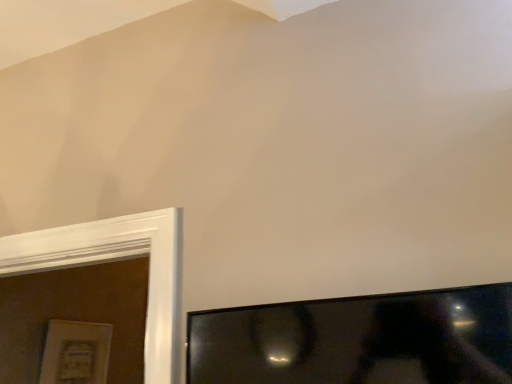
The height and width of the screenshot is (384, 512). Describe the element at coordinates (359, 340) in the screenshot. I see `black glossy tv at lower right` at that location.

Find the location of `black glossy tv at lower right`. black glossy tv at lower right is located at coordinates (359, 340).

What is the approximate height of black glossy tv at lower right?

It is 6.74 inches.

Locate an element on the screen. The height and width of the screenshot is (384, 512). matte white picture frame at lower left is located at coordinates (76, 353).

The image size is (512, 384). Describe the element at coordinates (76, 353) in the screenshot. I see `matte white picture frame at lower left` at that location.

The height and width of the screenshot is (384, 512). I want to click on black glossy tv at lower right, so click(359, 340).

Which object is positioned more to the right, black glossy tv at lower right or matte white picture frame at lower left?

From the viewer's perspective, black glossy tv at lower right appears more on the right side.

Is black glossy tv at lower right behind matte white picture frame at lower left?

No, it is not.

Which point is more distant from viewer, [445,338] or [86,372]?

Positioned behind is point [86,372].

From the image's perspective, is black glossy tv at lower right located beneath matte white picture frame at lower left?

No, from the image's perspective, black glossy tv at lower right is not beneath matte white picture frame at lower left.

From a real-world perspective, relative to matte white picture frame at lower left, is black glossy tv at lower right vertically above or below?

black glossy tv at lower right is situated higher than matte white picture frame at lower left in the real world.

Is black glossy tv at lower right wider than matte white picture frame at lower left?

Yes.

Does black glossy tv at lower right have a greater height compared to matte white picture frame at lower left?

In fact, black glossy tv at lower right may be shorter than matte white picture frame at lower left.

Who is smaller, black glossy tv at lower right or matte white picture frame at lower left?

With smaller size is matte white picture frame at lower left.

Is black glossy tv at lower right situated inside matte white picture frame at lower left or outside?

The correct answer is: outside.

Based on the photo, are black glossy tv at lower right and matte white picture frame at lower left far apart?

Yes.

Consider the image. Is black glossy tv at lower right oriented towards matte white picture frame at lower left?

No, black glossy tv at lower right is not facing towards matte white picture frame at lower left.

What's the angular difference between black glossy tv at lower right and matte white picture frame at lower left's facing directions?

They differ by 90 degrees in their facing directions.

How much distance is there between black glossy tv at lower right and matte white picture frame at lower left?

1.33 meters.

In the image, there is a matte white picture frame at lower left. At what (x,y) coordinates should I click in order to perform the action: click on television above it (from the image's perspective). Please return your answer as a coordinate pair (x, y). This screenshot has height=384, width=512. Looking at the image, I should click on (359, 340).

Is matte white picture frame at lower left at the right side of black glossy tv at lower right?

No.

Considering the positions of objects matte white picture frame at lower left and black glossy tv at lower right in the image provided, who is behind, matte white picture frame at lower left or black glossy tv at lower right?

matte white picture frame at lower left is more distant.

Which is nearer, (102, 355) or (410, 324)?

Clearly, point (102, 355) is more distant from the camera than point (410, 324).

From the image's perspective, would you say matte white picture frame at lower left is positioned over black glossy tv at lower right?

No, from the image's perspective, matte white picture frame at lower left is not above black glossy tv at lower right.

From a real-world perspective, does matte white picture frame at lower left stand above black glossy tv at lower right?

Incorrect, from a real-world perspective, matte white picture frame at lower left is lower than black glossy tv at lower right.

In the scene shown: Considering the relative sizes of matte white picture frame at lower left and black glossy tv at lower right in the image provided, is matte white picture frame at lower left wider than black glossy tv at lower right?

No.

Considering the relative sizes of matte white picture frame at lower left and black glossy tv at lower right in the image provided, is matte white picture frame at lower left shorter than black glossy tv at lower right?

No, matte white picture frame at lower left is not shorter than black glossy tv at lower right.

Which of these two, matte white picture frame at lower left or black glossy tv at lower right, is smaller?

With smaller size is matte white picture frame at lower left.

Is matte white picture frame at lower left inside the boundaries of black glossy tv at lower right, or outside?

matte white picture frame at lower left is not inside black glossy tv at lower right, it's outside.

Is matte white picture frame at lower left touching black glossy tv at lower right?

matte white picture frame at lower left and black glossy tv at lower right are clearly separated.

Is black glossy tv at lower right at the back of matte white picture frame at lower left?

No, matte white picture frame at lower left is not facing away from black glossy tv at lower right.

Can you tell me how much matte white picture frame at lower left and black glossy tv at lower right differ in facing direction?

They differ by 90 degrees in their facing directions.

At what (x,y) coordinates should I click in order to perform the action: click on picture frame on the left of black glossy tv at lower right. Please return your answer as a coordinate pair (x, y). Looking at the image, I should click on (76, 353).

Where is `picture frame lying behind the black glossy tv at lower right`? This screenshot has height=384, width=512. picture frame lying behind the black glossy tv at lower right is located at coordinates (76, 353).

Locate an element on the screen. television that appears on the right of matte white picture frame at lower left is located at coordinates (359, 340).